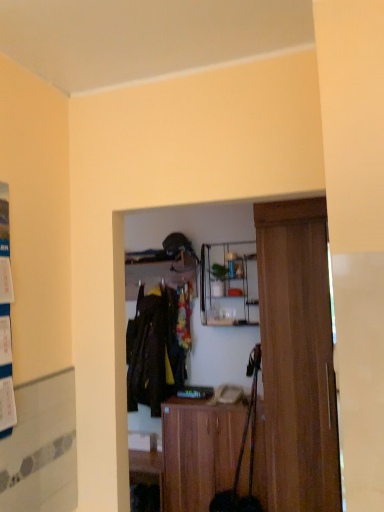
Question: Is wooden cabinet at center smaller than dark brown fabric coat at center?

Choices:
 (A) yes
 (B) no

Answer: (B)

Question: Does wooden cabinet at center have a greater width compared to dark brown fabric coat at center?

Choices:
 (A) yes
 (B) no

Answer: (A)

Question: Is wooden cabinet at center touching dark brown fabric coat at center?

Choices:
 (A) yes
 (B) no

Answer: (B)

Question: Does wooden cabinet at center have a greater height compared to dark brown fabric coat at center?

Choices:
 (A) no
 (B) yes

Answer: (A)

Question: From a real-world perspective, is wooden cabinet at center below dark brown fabric coat at center?

Choices:
 (A) no
 (B) yes

Answer: (B)

Question: In the image, is clear glass shelf at center, the 1th shelf from the right, positioned in front of or behind wooden shelf at center, the 2th shelf in the right-to-left sequence?

Choices:
 (A) front
 (B) behind

Answer: (A)

Question: In terms of height, does clear glass shelf at center, the 2th shelf viewed from the left, look taller or shorter compared to wooden shelf at center, the 2th shelf in the right-to-left sequence?

Choices:
 (A) short
 (B) tall

Answer: (B)

Question: Considering the positions of point (251, 258) and point (125, 256), is point (251, 258) closer or farther from the camera than point (125, 256)?

Choices:
 (A) farther
 (B) closer

Answer: (B)

Question: From a real-world perspective, is clear glass shelf at center, the 2th shelf viewed from the left, physically located above or below wooden shelf at center, the 1th shelf when ordered from left to right?

Choices:
 (A) below
 (B) above

Answer: (A)

Question: Is dark brown fabric coat at center inside the boundaries of clear glass shelf at center, the 2th shelf viewed from the left, or outside?

Choices:
 (A) inside
 (B) outside

Answer: (B)

Question: In terms of width, does dark brown fabric coat at center look wider or thinner when compared to clear glass shelf at center, the 1th shelf from the right?

Choices:
 (A) thin
 (B) wide

Answer: (A)

Question: Is dark brown fabric coat at center bigger or smaller than clear glass shelf at center, the 1th shelf from the right?

Choices:
 (A) small
 (B) big

Answer: (B)

Question: Is point (168, 308) closer or farther from the camera than point (228, 306)?

Choices:
 (A) farther
 (B) closer

Answer: (A)

Question: Is clear glass shelf at center, the 2th shelf viewed from the left, inside the boundaries of wooden cabinet at center, or outside?

Choices:
 (A) inside
 (B) outside

Answer: (B)

Question: From the image's perspective, relative to wooden cabinet at center, is clear glass shelf at center, the 1th shelf from the right, above or below?

Choices:
 (A) above
 (B) below

Answer: (A)